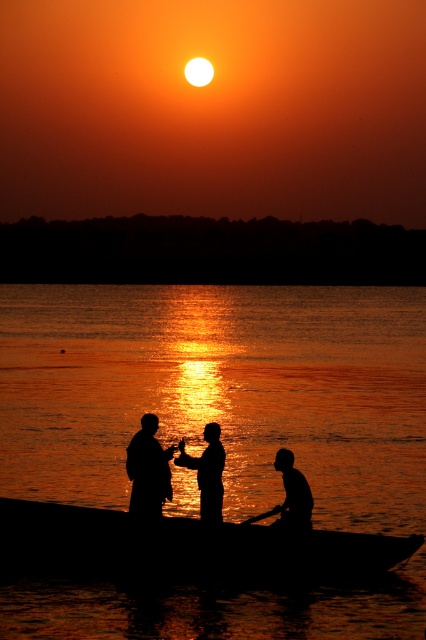
Based on the photo, does silhouette clothing at center have a smaller size compared to wooden smooth paddle at lower center?

No, silhouette clothing at center is not smaller than wooden smooth paddle at lower center.

Does silhouette clothing at center appear on the right side of wooden smooth paddle at lower center?

Incorrect, silhouette clothing at center is not on the right side of wooden smooth paddle at lower center.

Find the location of `silhouette clothing at center`. silhouette clothing at center is located at coordinates (147, 470).

The width and height of the screenshot is (426, 640). I want to click on silhouette clothing at center, so click(x=147, y=470).

Does black wood canoe at center have a greater width compared to silhouette wood boat at lower center?

Indeed, black wood canoe at center has a greater width compared to silhouette wood boat at lower center.

How distant is black wood canoe at center from silhouette wood boat at lower center?

3.83 feet

What are the coordinates of `black wood canoe at center` in the screenshot? It's located at (187, 545).

Which is behind, point (135, 493) or point (213, 499)?

The point (135, 493) is more distant.

Is point (152, 516) positioned after point (207, 428)?

No, (152, 516) is closer to viewer.

Between point (141, 433) and point (204, 483), which one is positioned in front?

Point (204, 483) is in front.

Find the location of a particular element. This screenshot has height=640, width=426. silhouette wood fisherman at center is located at coordinates (147, 470).